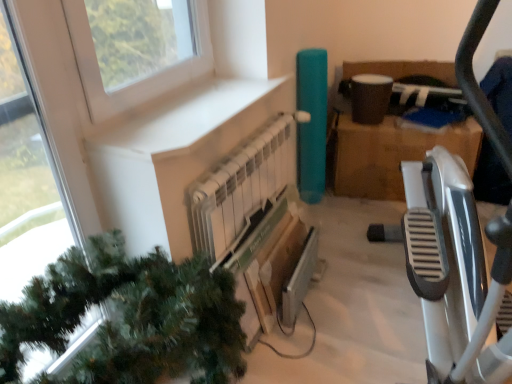
Question: Considering the relative sizes of transparent glass window at upper left and white metallic radiator at center in the image provided, is transparent glass window at upper left bigger than white metallic radiator at center?

Choices:
 (A) yes
 (B) no

Answer: (B)

Question: Is transparent glass window at upper left positioned with its back to white metallic radiator at center?

Choices:
 (A) yes
 (B) no

Answer: (B)

Question: Can you confirm if transparent glass window at upper left is thinner than white metallic radiator at center?

Choices:
 (A) no
 (B) yes

Answer: (B)

Question: From a real-world perspective, is transparent glass window at upper left positioned under white metallic radiator at center based on gravity?

Choices:
 (A) yes
 (B) no

Answer: (B)

Question: Is transparent glass window at upper left completely or partially outside of white metallic radiator at center?

Choices:
 (A) yes
 (B) no

Answer: (A)

Question: From a real-world perspective, is metallic silver tv at center above or below green matte christmas tree at lower left?

Choices:
 (A) below
 (B) above

Answer: (A)

Question: Is metallic silver tv at center situated inside green matte christmas tree at lower left or outside?

Choices:
 (A) inside
 (B) outside

Answer: (B)

Question: Considering the positions of metallic silver tv at center and green matte christmas tree at lower left in the image, is metallic silver tv at center taller or shorter than green matte christmas tree at lower left?

Choices:
 (A) short
 (B) tall

Answer: (A)

Question: In terms of width, does metallic silver tv at center look wider or thinner when compared to green matte christmas tree at lower left?

Choices:
 (A) wide
 (B) thin

Answer: (B)

Question: From a real-world perspective, relative to white metallic radiator at center, is white matte window sill at upper left vertically above or below?

Choices:
 (A) below
 (B) above

Answer: (B)

Question: Considering the positions of white matte window sill at upper left and white metallic radiator at center in the image, is white matte window sill at upper left taller or shorter than white metallic radiator at center?

Choices:
 (A) tall
 (B) short

Answer: (B)

Question: In terms of size, does white matte window sill at upper left appear bigger or smaller than white metallic radiator at center?

Choices:
 (A) small
 (B) big

Answer: (A)

Question: Relative to white metallic radiator at center, is white matte window sill at upper left in front or behind?

Choices:
 (A) front
 (B) behind

Answer: (A)

Question: Considering their positions, is transparent glass window at upper left located in front of or behind brown cardboard box at center-right?

Choices:
 (A) behind
 (B) front

Answer: (B)

Question: Looking at the image, does transparent glass window at upper left seem bigger or smaller compared to brown cardboard box at center-right?

Choices:
 (A) big
 (B) small

Answer: (B)